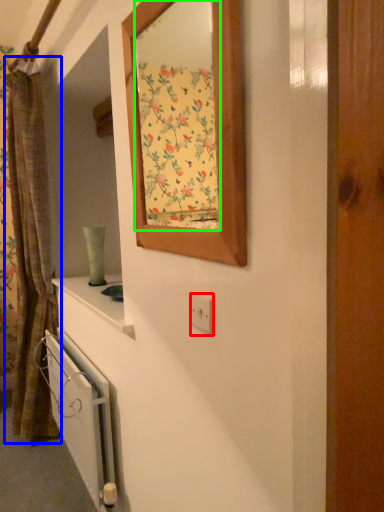
Question: Which object is the closest to the electric outlet (highlighted by a red box)? Choose among these: curtain (highlighted by a blue box) or mirror (highlighted by a green box).

Choices:
 (A) curtain
 (B) mirror

Answer: (A)